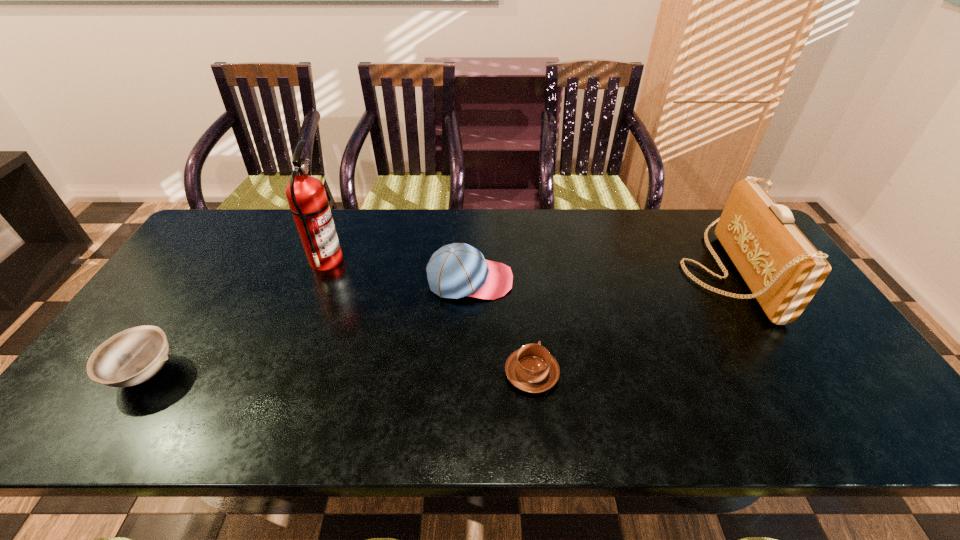
This screenshot has width=960, height=540. Find the location of `the second object from left to right`. the second object from left to right is located at coordinates (309, 205).

The width and height of the screenshot is (960, 540). In order to click on the tallest object in this screenshot , I will do `click(309, 205)`.

The image size is (960, 540). Identify the location of the rightmost object. (782, 268).

Identify the location of the fourth shortest object. (782, 268).

Image resolution: width=960 pixels, height=540 pixels. Find the location of `the third tallest object`. the third tallest object is located at coordinates (456, 270).

Identify the location of bowl. (133, 356).

Locate an element on the screen. The image size is (960, 540). the fourth tallest object is located at coordinates (133, 356).

You are a GUI agent. You are given a task and a screenshot of the screen. Output one action in this format:
    pyautogui.click(x=<x>, y=<y>)
    Task: Click on the cappuccino
    
    Given the screenshot: What is the action you would take?
    pyautogui.click(x=532, y=369)

Where is `free location located 0.350m at the nozzle of the tallest object`? The width and height of the screenshot is (960, 540). free location located 0.350m at the nozzle of the tallest object is located at coordinates (456, 260).

Image resolution: width=960 pixels, height=540 pixels. In order to click on free space located 0.340m on the decorative side of the rightmost object in this screenshot , I will do `click(568, 271)`.